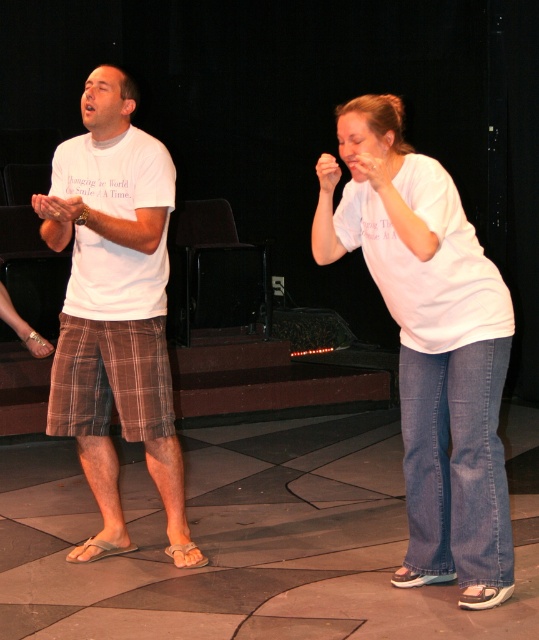
Question: Does white cotton shirt at center have a larger size compared to white t-shirt at left?

Choices:
 (A) yes
 (B) no

Answer: (B)

Question: Which point is closer to the camera taking this photo?

Choices:
 (A) (134, 147)
 (B) (354, 216)

Answer: (B)

Question: Is white cotton shirt at center behind white t-shirt at left?

Choices:
 (A) yes
 (B) no

Answer: (B)

Question: Is the position of white cotton shirt at center more distant than that of white t-shirt at left?

Choices:
 (A) no
 (B) yes

Answer: (A)